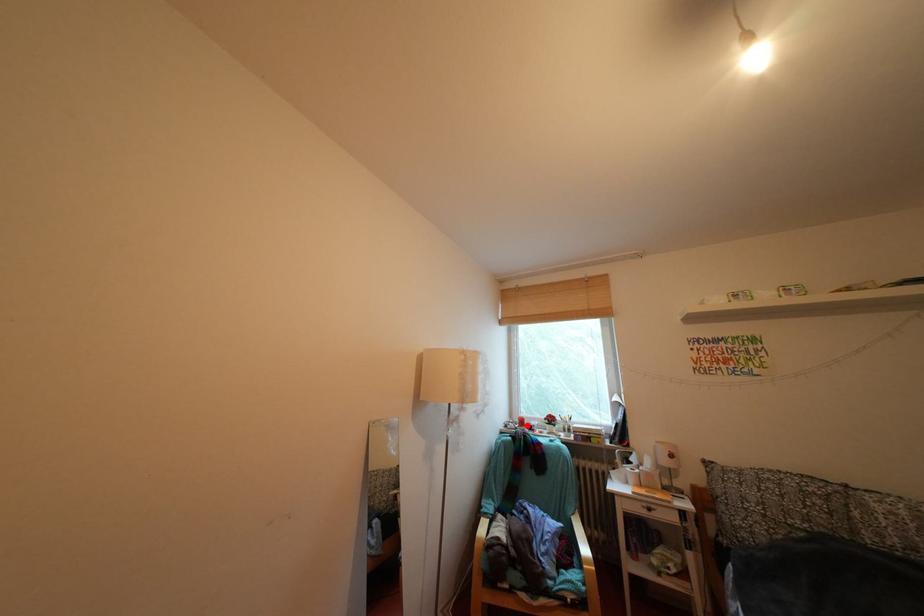
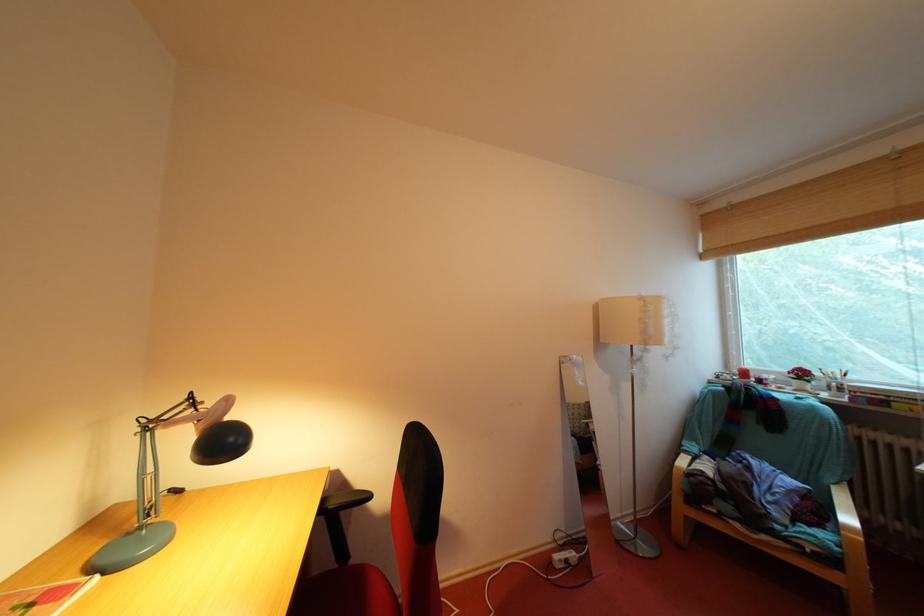
Where in the second image is the point corresponding to the highlighted location from the first image?

(746, 377)